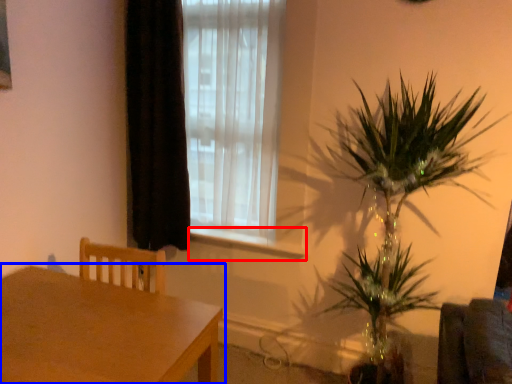
Question: Which of the following is the closest to the observer, window sill (highlighted by a red box) or table (highlighted by a blue box)?

Choices:
 (A) window sill
 (B) table

Answer: (B)